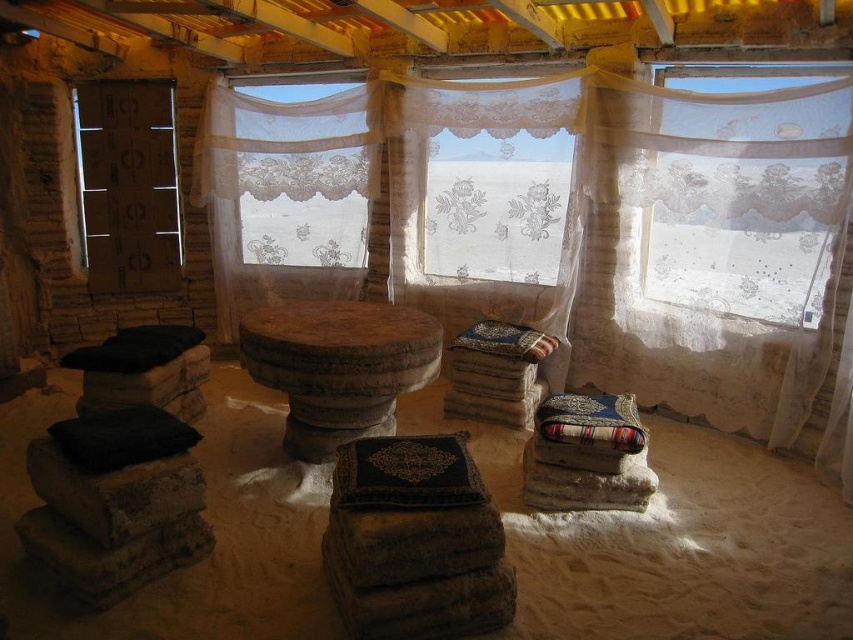
Between point (334, 387) and point (618, 442), which one is positioned in front?

Positioned in front is point (618, 442).

Find the location of a particular element. The image size is (853, 640). rustic wood table at center is located at coordinates (338, 365).

Between translucent lace curtain at upper right and matte cardboard at left, which one is positioned lower?

translucent lace curtain at upper right is below.

Which is in front, point (815, 97) or point (138, 192)?

Positioned in front is point (815, 97).

Find the location of `translucent lace curtain at upper right`. translucent lace curtain at upper right is located at coordinates (x=746, y=205).

This screenshot has height=640, width=853. Find the location of `translucent lace curtain at upper right`. translucent lace curtain at upper right is located at coordinates (746, 205).

Looking at this image, does matte cardboard at left have a smaller size compared to black soft pillow at lower left?

Incorrect, matte cardboard at left is not smaller in size than black soft pillow at lower left.

Is matte cardboard at left positioned before black soft pillow at lower left?

No, it is behind black soft pillow at lower left.

Is point (177, 209) closer to viewer compared to point (109, 458)?

No, (177, 209) is behind (109, 458).

Identify the location of matte cardboard at left. (126, 184).